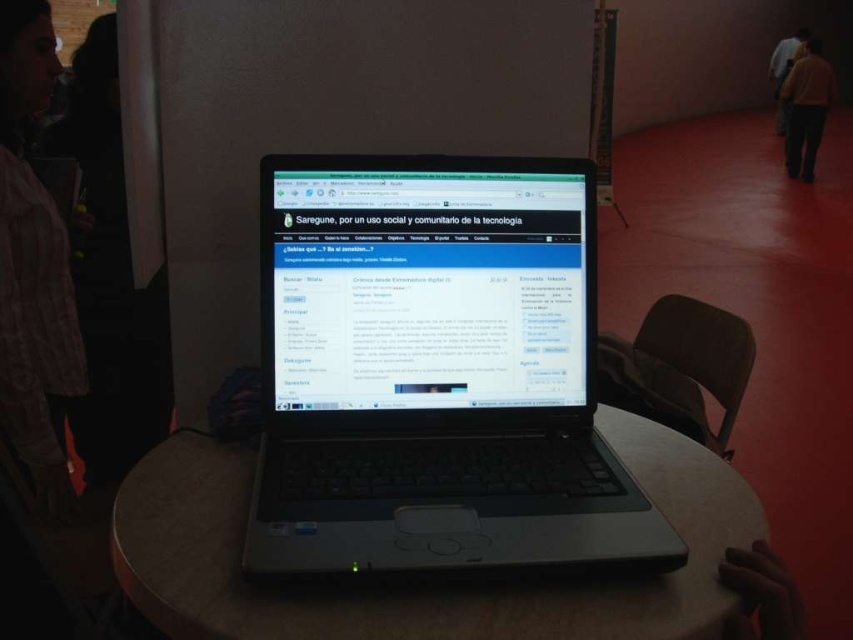
Find the location of a particular element. Image resolution: width=853 pixels, height=640 pixels. shiny black laptop at center is located at coordinates (425, 285).

Which is behind, point (312, 364) or point (33, 476)?

The point (33, 476) is more distant.

Where is `shiny black laptop at center`? This screenshot has width=853, height=640. shiny black laptop at center is located at coordinates (425, 285).

In order to click on smooth wooden table at center in this screenshot , I will do `click(421, 577)`.

Measure the distance between point (177, 595) and camera.

A distance of 22.92 inches exists between point (177, 595) and camera.

Is point (357, 625) closer to viewer compared to point (792, 51)?

Yes, it is in front of point (792, 51).

The width and height of the screenshot is (853, 640). Identify the location of smooth wooden table at center. (421, 577).

Which is in front, point (505, 326) or point (775, 65)?

Point (505, 326) is in front.

Is black plastic laptop at center positioned at the back of light brown leather jacket at upper right?

No, it is in front of light brown leather jacket at upper right.

What do you see at coordinates (434, 371) in the screenshot?
I see `black plastic laptop at center` at bounding box center [434, 371].

The width and height of the screenshot is (853, 640). Identify the location of black plastic laptop at center. (434, 371).